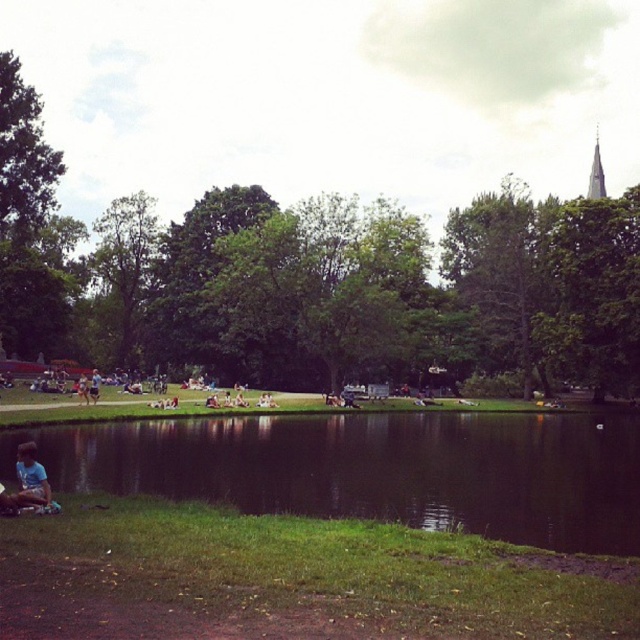
You are standing at the center of the park and want to find the green grass at lower left. According to the coordinates provided, in which direction should you move to locate it?

The green grass at lower left is located at coordinates point (291, 579). Since the coordinate system likely places the origin at the bottom left corner, moving towards the lower left from the center would lead you to the green grass at lower left.

You are standing on the green grass at lower left and want to pick up the light blue fabric at lower left. In which direction should you move to reach it?

The green grass at lower left is positioned on the right side of the light blue fabric at lower left, so you should move to your left to reach the light blue fabric at lower left.

Consider the image. You are a photographer standing at the park entrance and see two light blue fabrics in the scene. The first is a light blue fabric shirt at lower left, and the second is a light blue fabric at lower left. Which of these two items has a narrower width?

The light blue fabric shirt at lower left is thinner than the light blue fabric at lower left, so the light blue fabric shirt at lower left has a narrower width.